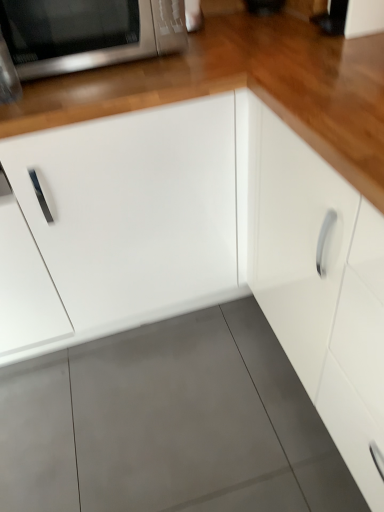
Question: Considering the relative sizes of white matte cabinet at center, which is counted as the 1th cabinetry, starting from the left, and satin silver microwave at upper left in the image provided, is white matte cabinet at center, which is counted as the 1th cabinetry, starting from the left, shorter than satin silver microwave at upper left?

Choices:
 (A) no
 (B) yes

Answer: (A)

Question: Does white matte cabinet at center, which is counted as the 1th cabinetry, starting from the left, contain satin silver microwave at upper left?

Choices:
 (A) no
 (B) yes

Answer: (A)

Question: Considering the relative sizes of white matte cabinet at center, which is counted as the 1th cabinetry, starting from the left, and satin silver microwave at upper left in the image provided, is white matte cabinet at center, which is counted as the 1th cabinetry, starting from the left, smaller than satin silver microwave at upper left?

Choices:
 (A) yes
 (B) no

Answer: (B)

Question: Considering the relative sizes of white matte cabinet at center, the second cabinetry viewed from the right, and satin silver microwave at upper left in the image provided, is white matte cabinet at center, the second cabinetry viewed from the right, thinner than satin silver microwave at upper left?

Choices:
 (A) no
 (B) yes

Answer: (A)

Question: Is white matte cabinet at center, which is counted as the 1th cabinetry, starting from the left, closer to camera compared to satin silver microwave at upper left?

Choices:
 (A) yes
 (B) no

Answer: (A)

Question: Considering the relative positions of white matte cabinet at center, which is counted as the 1th cabinetry, starting from the left, and satin silver microwave at upper left in the image provided, is white matte cabinet at center, which is counted as the 1th cabinetry, starting from the left, to the left of satin silver microwave at upper left from the viewer's perspective?

Choices:
 (A) no
 (B) yes

Answer: (A)

Question: Is satin silver microwave at upper left oriented away from white matte cabinet at center, the second cabinetry viewed from the right?

Choices:
 (A) no
 (B) yes

Answer: (A)

Question: Does satin silver microwave at upper left have a lesser height compared to white matte cabinet at center, which is counted as the 1th cabinetry, starting from the left?

Choices:
 (A) yes
 (B) no

Answer: (A)

Question: Is white matte cabinet at center, the second cabinetry viewed from the right, completely or partially inside satin silver microwave at upper left?

Choices:
 (A) yes
 (B) no

Answer: (B)

Question: Is satin silver microwave at upper left positioned beyond the bounds of white matte cabinet at center, the second cabinetry viewed from the right?

Choices:
 (A) no
 (B) yes

Answer: (B)

Question: Can you confirm if satin silver microwave at upper left is smaller than white matte cabinet at center, which is counted as the 1th cabinetry, starting from the left?

Choices:
 (A) no
 (B) yes

Answer: (B)

Question: From the image's perspective, is satin silver microwave at upper left beneath white matte cabinet at center, the second cabinetry viewed from the right?

Choices:
 (A) yes
 (B) no

Answer: (B)

Question: Does white matte cabinet at center, the second cabinetry viewed from the right, lie in front of white glossy cabinet at center, positioned as the second cabinetry in left-to-right order?

Choices:
 (A) no
 (B) yes

Answer: (A)